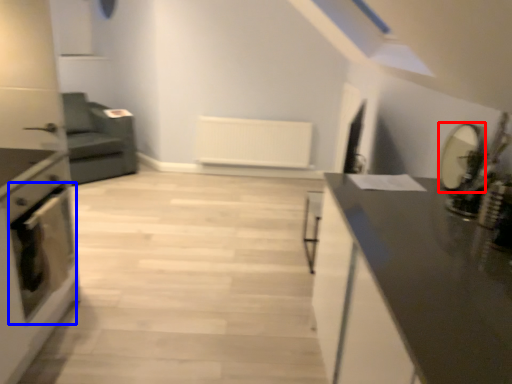
Question: Which object appears farthest to the camera in this image, appliance (highlighted by a red box) or oven (highlighted by a blue box)?

Choices:
 (A) appliance
 (B) oven

Answer: (B)